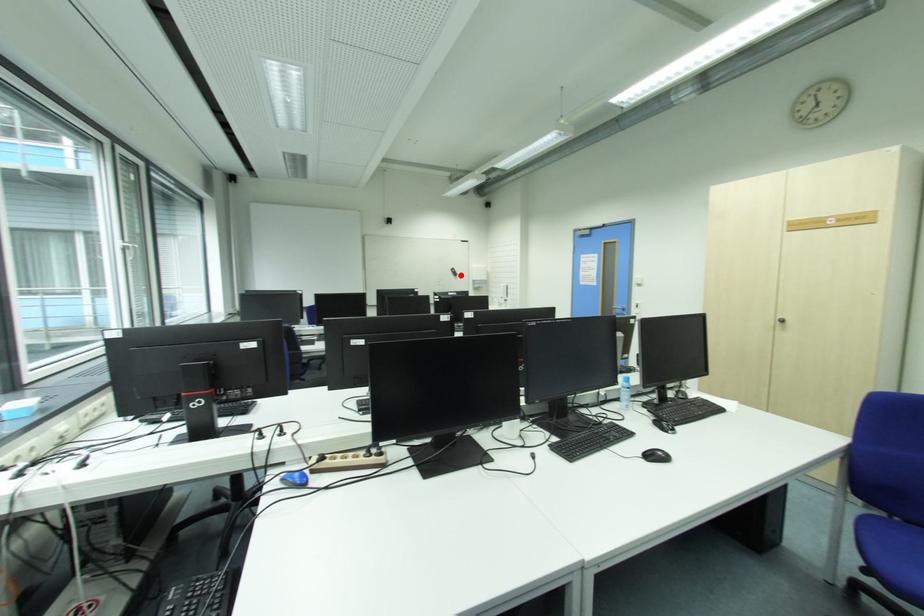
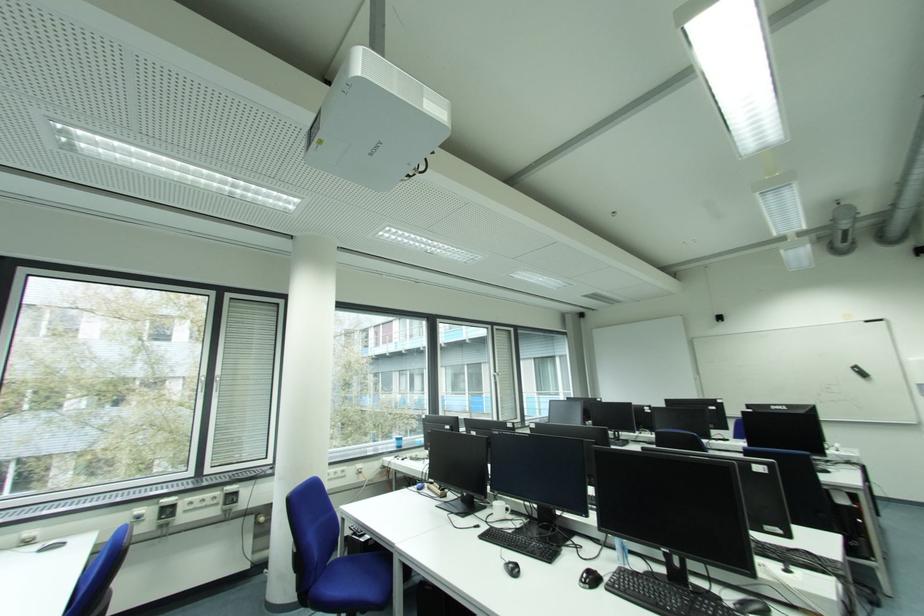
Where in the second image is the point corresponding to the highlighted location from the first image?

(869, 376)